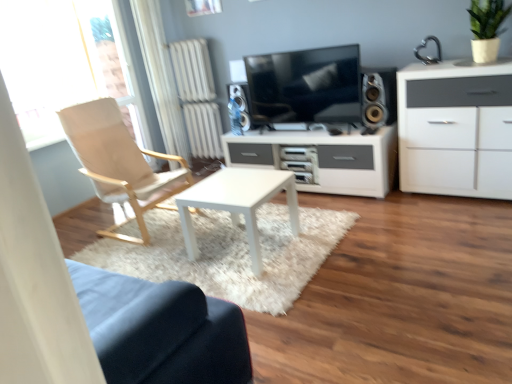
The image size is (512, 384). I want to click on free location to the left of white matte coffee table at center, so click(176, 252).